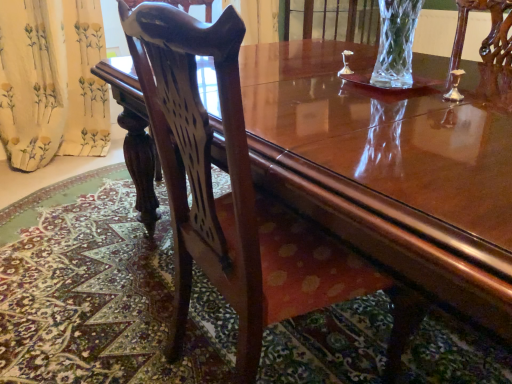
Image resolution: width=512 pixels, height=384 pixels. Describe the element at coordinates (52, 81) in the screenshot. I see `yellow floral fabric at left` at that location.

You are a GUI agent. You are given a task and a screenshot of the screen. Output one action in this format:
    pyautogui.click(x=<x>, y=<y>)
    Task: Click on the yellow floral fabric at left
    The image size is (512, 384).
    Given the screenshot: What is the action you would take?
    (x=52, y=81)

Image resolution: width=512 pixels, height=384 pixels. What do you see at coordinates (238, 198) in the screenshot? I see `mahogany wood chair at center` at bounding box center [238, 198].

You are a GUI agent. You are given a task and a screenshot of the screen. Output one action in this format:
    pyautogui.click(x=<x>, y=<y>)
    Task: Click on the mahogany wood chair at center
    The height and width of the screenshot is (384, 512).
    Given the screenshot: What is the action you would take?
    pyautogui.click(x=238, y=198)

Where is `yellow floral fabric at left`? The height and width of the screenshot is (384, 512). yellow floral fabric at left is located at coordinates (52, 81).

Which is more to the right, mahogany wood chair at center or yellow floral fabric at left?

mahogany wood chair at center.

Is mahogany wood chair at center in front of yellow floral fabric at left?

Yes, mahogany wood chair at center is closer to the camera.

Which is closer to the camera, (x=234, y=18) or (x=91, y=130)?

The point (x=234, y=18) is in front.

From the image's perspective, between mahogany wood chair at center and yellow floral fabric at left, which one is located above?

yellow floral fabric at left, from the image's perspective.

From a real-world perspective, is mahogany wood chair at center positioned above or below yellow floral fabric at left?

In terms of real-world spatial position, mahogany wood chair at center is above yellow floral fabric at left.

Is mahogany wood chair at center wider or thinner than yellow floral fabric at left?

In the image, mahogany wood chair at center appears to be wider than yellow floral fabric at left.

Does mahogany wood chair at center have a greater height compared to yellow floral fabric at left?

Yes.

Is mahogany wood chair at center bigger than yellow floral fabric at left?

Correct, mahogany wood chair at center is larger in size than yellow floral fabric at left.

Is yellow floral fabric at left a part of mahogany wood chair at center?

Actually, yellow floral fabric at left is outside mahogany wood chair at center.

Is mahogany wood chair at center far from yellow floral fabric at left?

A: mahogany wood chair at center is far away from yellow floral fabric at left.

Is mahogany wood chair at center looking in the opposite direction of yellow floral fabric at left?

No.

Measure the distance from mahogany wood chair at center to yellow floral fabric at left.

mahogany wood chair at center is 6.27 feet from yellow floral fabric at left.

This screenshot has width=512, height=384. I want to click on curtain below the mahogany wood chair at center (from a real-world perspective), so click(x=52, y=81).

Considering the relative positions of yellow floral fabric at left and mahogany wood chair at center in the image provided, is yellow floral fabric at left to the right of mahogany wood chair at center from the viewer's perspective?

No, yellow floral fabric at left is not to the right of mahogany wood chair at center.

Between yellow floral fabric at left and mahogany wood chair at center, which one is positioned behind?

yellow floral fabric at left is behind.

Is point (8, 141) positioned after point (167, 30)?

Yes.

From the image's perspective, which one is positioned lower, yellow floral fabric at left or mahogany wood chair at center?

mahogany wood chair at center.

From a real-world perspective, is yellow floral fabric at left physically located above or below mahogany wood chair at center?

yellow floral fabric at left is situated lower than mahogany wood chair at center in the real world.

Looking at their sizes, would you say yellow floral fabric at left is wider or thinner than mahogany wood chair at center?

Clearly, yellow floral fabric at left has less width compared to mahogany wood chair at center.

Does yellow floral fabric at left have a lesser height compared to mahogany wood chair at center?

Yes, yellow floral fabric at left is shorter than mahogany wood chair at center.

Is yellow floral fabric at left bigger or smaller than mahogany wood chair at center?

yellow floral fabric at left is smaller than mahogany wood chair at center.

Is yellow floral fabric at left situated inside mahogany wood chair at center or outside?

yellow floral fabric at left exists outside the volume of mahogany wood chair at center.

Is yellow floral fabric at left far away from mahogany wood chair at center?

yellow floral fabric at left is far away from mahogany wood chair at center.

Is yellow floral fabric at left facing away from mahogany wood chair at center?

yellow floral fabric at left does not have its back to mahogany wood chair at center.

How many degrees apart are the facing directions of yellow floral fabric at left and mahogany wood chair at center?

82.8 degrees separate the facing orientations of yellow floral fabric at left and mahogany wood chair at center.

Locate an element on the screen. curtain behind the mahogany wood chair at center is located at coordinates (52, 81).

Where is `curtain behind the mahogany wood chair at center`? The height and width of the screenshot is (384, 512). curtain behind the mahogany wood chair at center is located at coordinates (52, 81).

Locate an element on the screen. curtain below the mahogany wood chair at center (from a real-world perspective) is located at coordinates (52, 81).